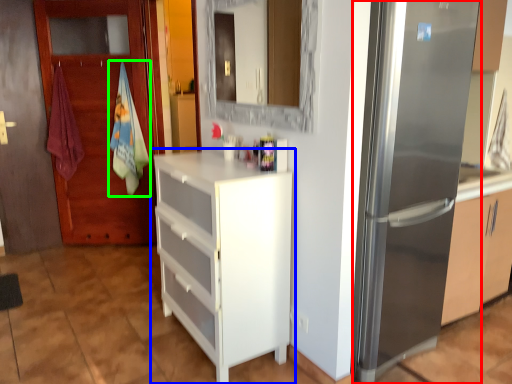
Question: Which object is the farthest from refrigerator (highlighted by a red box)? Choose among these: chest of drawers (highlighted by a blue box) or beach towel (highlighted by a green box).

Choices:
 (A) chest of drawers
 (B) beach towel

Answer: (B)